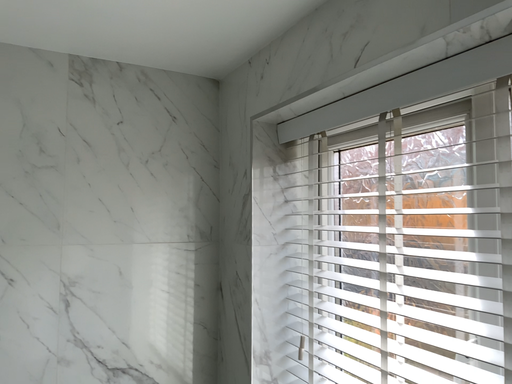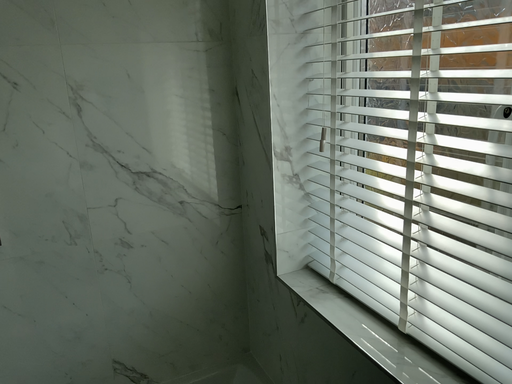
Question: How did the camera likely rotate when shooting the video?

Choices:
 (A) rotated upward
 (B) rotated downward

Answer: (B)